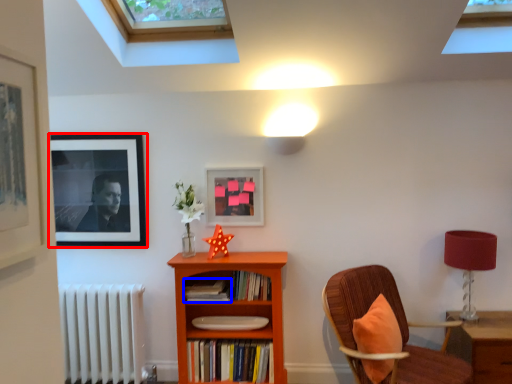
Question: Which object is closer to the camera taking this photo, picture frame (highlighted by a red box) or book (highlighted by a blue box)?

Choices:
 (A) picture frame
 (B) book

Answer: (B)